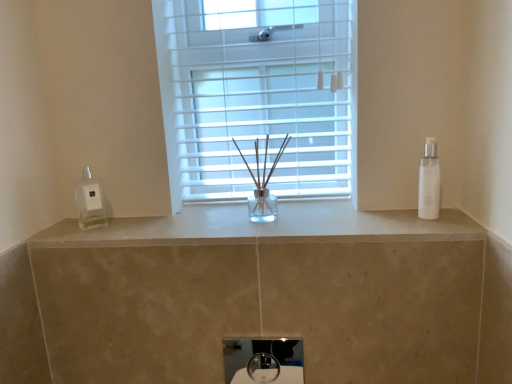
Question: From the image's perspective, is white plastic window at center under white glossy sink at center?

Choices:
 (A) no
 (B) yes

Answer: (A)

Question: Is white plastic window at center wider than white glossy sink at center?

Choices:
 (A) yes
 (B) no

Answer: (A)

Question: Does white plastic window at center have a smaller size compared to white glossy sink at center?

Choices:
 (A) yes
 (B) no

Answer: (B)

Question: From the image's perspective, would you say white plastic window at center is positioned over white glossy sink at center?

Choices:
 (A) yes
 (B) no

Answer: (A)

Question: Is white plastic window at center oriented away from white glossy sink at center?

Choices:
 (A) no
 (B) yes

Answer: (A)

Question: Does white plastic window at center have a lesser width compared to white glossy sink at center?

Choices:
 (A) no
 (B) yes

Answer: (A)

Question: From the image's perspective, is white glossy soap dispenser at left located beneath white marble counter at center?

Choices:
 (A) yes
 (B) no

Answer: (B)

Question: Can we say white glossy soap dispenser at left lies outside white marble counter at center?

Choices:
 (A) no
 (B) yes

Answer: (B)

Question: Considering the relative positions of white glossy soap dispenser at left and white marble counter at center in the image provided, is white glossy soap dispenser at left to the right of white marble counter at center from the viewer's perspective?

Choices:
 (A) no
 (B) yes

Answer: (A)

Question: Is white glossy soap dispenser at left wider than white marble counter at center?

Choices:
 (A) no
 (B) yes

Answer: (A)

Question: From a real-world perspective, is white glossy soap dispenser at left under white marble counter at center?

Choices:
 (A) no
 (B) yes

Answer: (A)

Question: Considering the relative sizes of white glossy soap dispenser at left and white marble counter at center in the image provided, is white glossy soap dispenser at left taller than white marble counter at center?

Choices:
 (A) yes
 (B) no

Answer: (A)

Question: Is white glossy bottle at right not close to white marble counter at center?

Choices:
 (A) yes
 (B) no

Answer: (B)